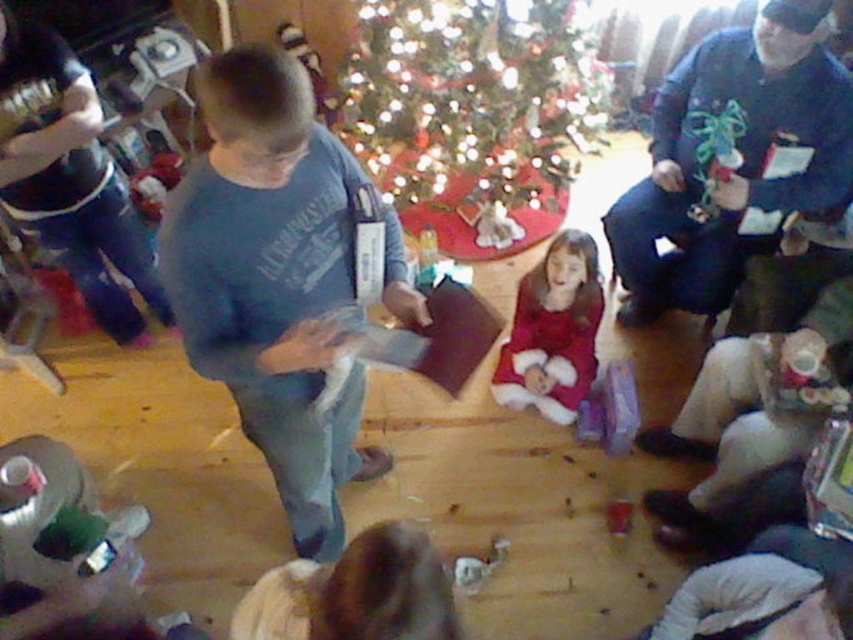
You are standing at point (x=726, y=108) and want to move to point (x=419, y=44). Will you be moving forward or backward?

Since point (x=419, y=44) is behind point (x=726, y=108), moving to it from your current position would require moving backward.

Consider the image. You are a photographer at the event and want to capture a clear shot of the blue cotton shirt at center without the blue fleece sweater at center blocking it. How should you adjust your camera angle?

The blue cotton shirt at center is below the blue fleece sweater at center. To avoid the sweater blocking the shirt, you should angle the camera downward to focus on the lower area where the shirt is located.

You are a photographer trying to capture a candid shot of the blue cotton shirt at center and the blue fleece sweater at center. Since you want to ensure both are clearly visible, which clothing item should you focus on first to account for their sizes?

The blue cotton shirt at center is larger in size than the blue fleece sweater at center, so you should focus on the blue cotton shirt at center first to ensure it is clearly visible due to its larger size.